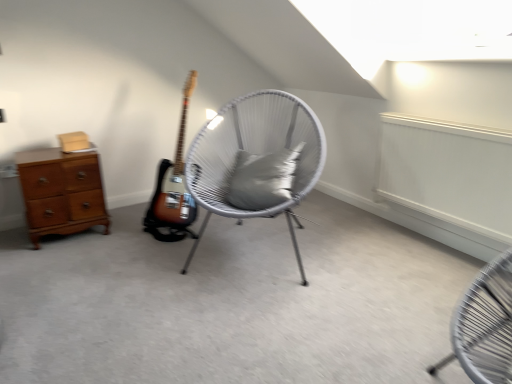
Question: Is wooden chest of drawers at left at the left side of white woven chair at center?

Choices:
 (A) yes
 (B) no

Answer: (A)

Question: Is white woven chair at center at the back of wooden chest of drawers at left?

Choices:
 (A) no
 (B) yes

Answer: (A)

Question: Considering the relative sizes of wooden chest of drawers at left and white woven chair at center in the image provided, is wooden chest of drawers at left wider than white woven chair at center?

Choices:
 (A) yes
 (B) no

Answer: (B)

Question: Can you confirm if wooden chest of drawers at left is positioned to the right of white woven chair at center?

Choices:
 (A) no
 (B) yes

Answer: (A)

Question: Is wooden chest of drawers at left closer to the viewer compared to white woven chair at center?

Choices:
 (A) yes
 (B) no

Answer: (B)

Question: Is wooden chest of drawers at left shorter than white woven chair at center?

Choices:
 (A) yes
 (B) no

Answer: (A)

Question: Considering the relative sizes of white woven chair at center and wooden chest of drawers at left in the image provided, is white woven chair at center bigger than wooden chest of drawers at left?

Choices:
 (A) no
 (B) yes

Answer: (B)

Question: Does white woven chair at center have a greater height compared to wooden chest of drawers at left?

Choices:
 (A) yes
 (B) no

Answer: (A)

Question: From the image's perspective, would you say white woven chair at center is positioned over wooden chest of drawers at left?

Choices:
 (A) no
 (B) yes

Answer: (B)

Question: Is white woven chair at center oriented towards wooden chest of drawers at left?

Choices:
 (A) no
 (B) yes

Answer: (A)

Question: Considering the relative sizes of white woven chair at center and wooden chest of drawers at left in the image provided, is white woven chair at center wider than wooden chest of drawers at left?

Choices:
 (A) no
 (B) yes

Answer: (B)

Question: Is white woven chair at center looking in the opposite direction of wooden chest of drawers at left?

Choices:
 (A) no
 (B) yes

Answer: (A)

Question: From the image's perspective, is gray fabric pillow at center located above white woven chair at center?

Choices:
 (A) yes
 (B) no

Answer: (A)